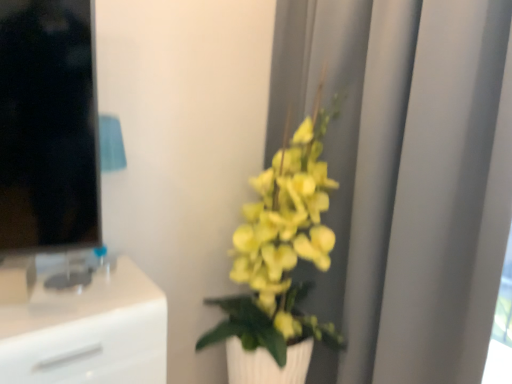
Find the location of `yellow artificial flowers at center`. yellow artificial flowers at center is located at coordinates (404, 178).

The width and height of the screenshot is (512, 384). Describe the element at coordinates (404, 178) in the screenshot. I see `yellow artificial flowers at center` at that location.

Locate an element on the screen. The width and height of the screenshot is (512, 384). yellow artificial flowers at center is located at coordinates (404, 178).